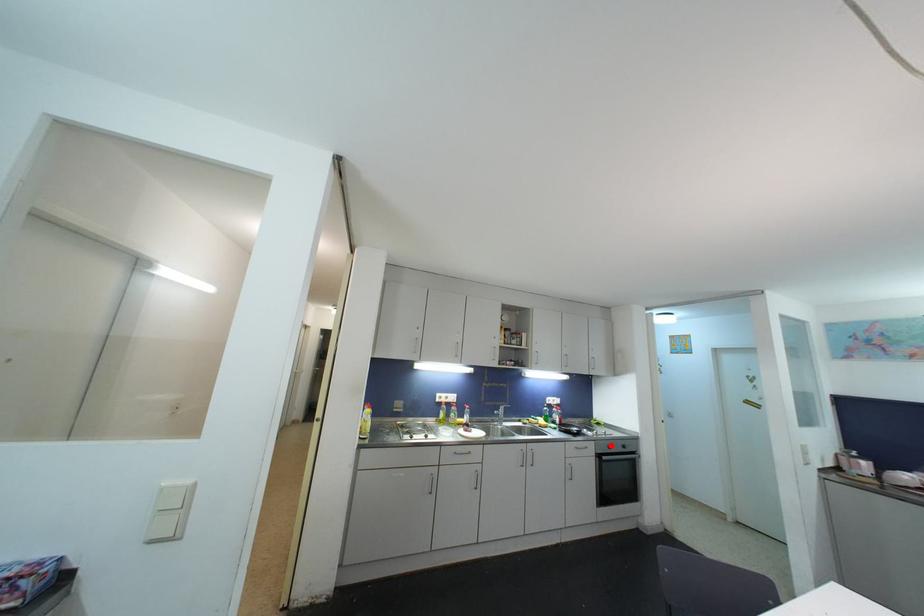
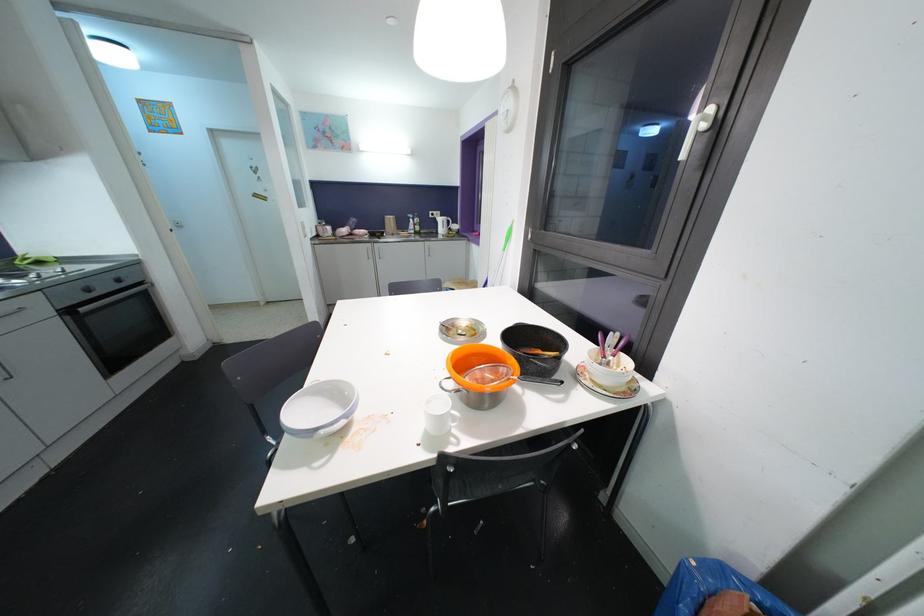
Find the pixel in the second image that matches the highlighted location in the first image.

(83, 286)